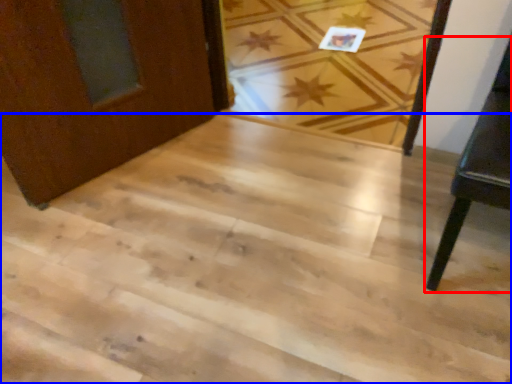
Question: Which point is further to the camera, furniture (highlighted by a red box) or stairwell (highlighted by a blue box)?

Choices:
 (A) furniture
 (B) stairwell

Answer: (B)